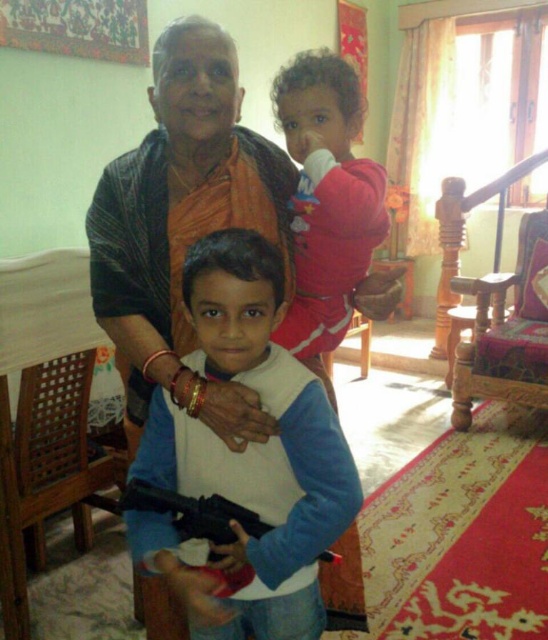
Based on the photo, you are a photographer adjusting your camera settings. You notice the fluffy pink sweater at upper right and the black plastic gun at center. Which object is closer to your camera?

The fluffy pink sweater at upper right is closer to the camera because it is further to the viewer than the black plastic gun at center.

You are a photographer setting up for a family portrait. You notice the fluffy pink sweater at upper right and the black plastic gun at center. Which object should you adjust your camera focus on if you want to capture the larger object in the frame?

The fluffy pink sweater at upper right should be the focus since it has a larger size compared to the black plastic gun at center.

You are a photographer setting up for a family portrait. You notice the white matte vest at center and the black plastic gun at center in the scene. Which object should you adjust to ensure both are fully visible in the frame?

The white matte vest at center is taller than the black plastic gun at center. To ensure both are fully visible, you should adjust the camera angle or position to accommodate the height of the white matte vest at center.